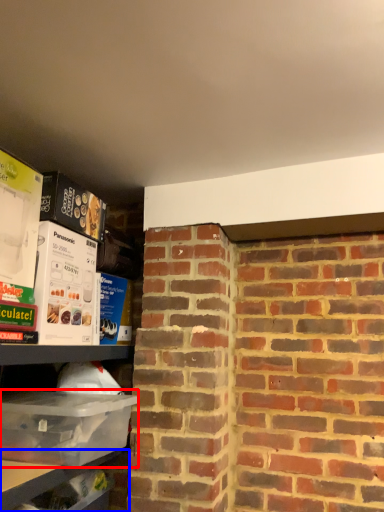
Question: Which object is closer to the camera taking this photo, box (highlighted by a red box) or shelf (highlighted by a blue box)?

Choices:
 (A) box
 (B) shelf

Answer: (A)